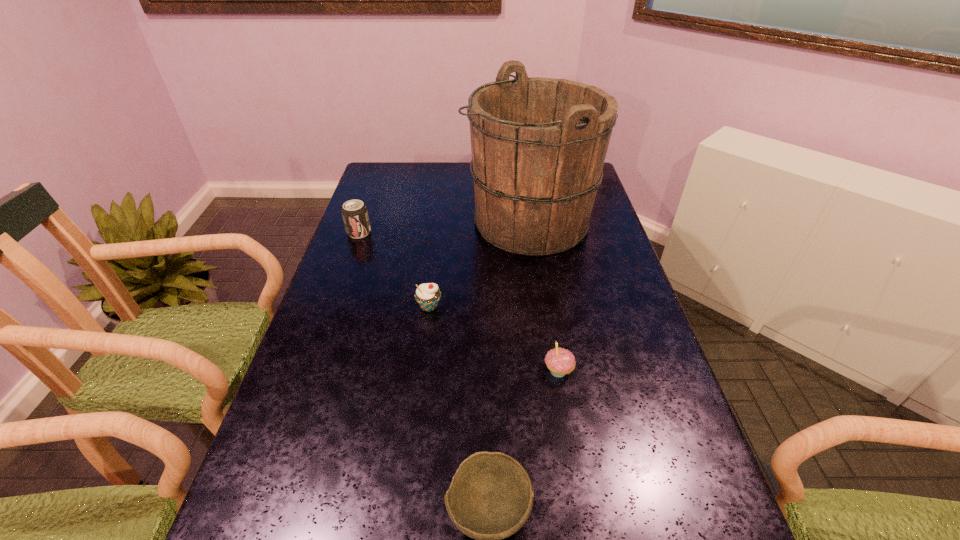
Locate an element on the screen. The height and width of the screenshot is (540, 960). object located at the far edge is located at coordinates (538, 145).

Find the location of a particular element. This screenshot has height=540, width=960. object that is positioned at the left edge is located at coordinates (355, 215).

Image resolution: width=960 pixels, height=540 pixels. Find the location of `object that is at the right edge`. object that is at the right edge is located at coordinates (538, 145).

Locate an element on the screen. This screenshot has height=540, width=960. object that is at the far right corner is located at coordinates (538, 145).

Where is `free spot at the far edge of the desktop`? The image size is (960, 540). free spot at the far edge of the desktop is located at coordinates (462, 162).

I want to click on free space at the left edge of the desktop, so click(x=369, y=234).

Where is `vacant region at the right edge of the desktop`? Image resolution: width=960 pixels, height=540 pixels. vacant region at the right edge of the desktop is located at coordinates tap(602, 205).

Locate an element on the screen. The height and width of the screenshot is (540, 960). free space between the soda can and the right cupcake is located at coordinates (459, 302).

I want to click on empty space between the third farthest object and the tallest object, so coord(479,265).

Where is `vacant space that is in between the bucket and the leftmost object`? vacant space that is in between the bucket and the leftmost object is located at coordinates (444, 227).